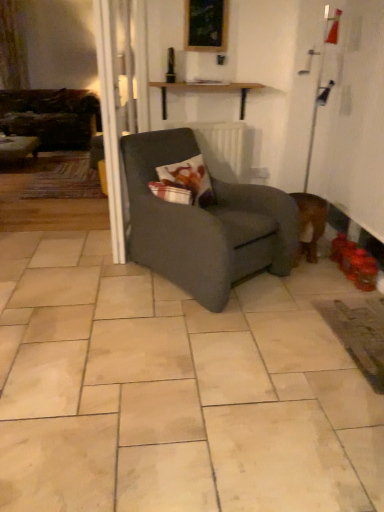
Identify the location of free space to the left of dark gray fabric chair at center. (77, 274).